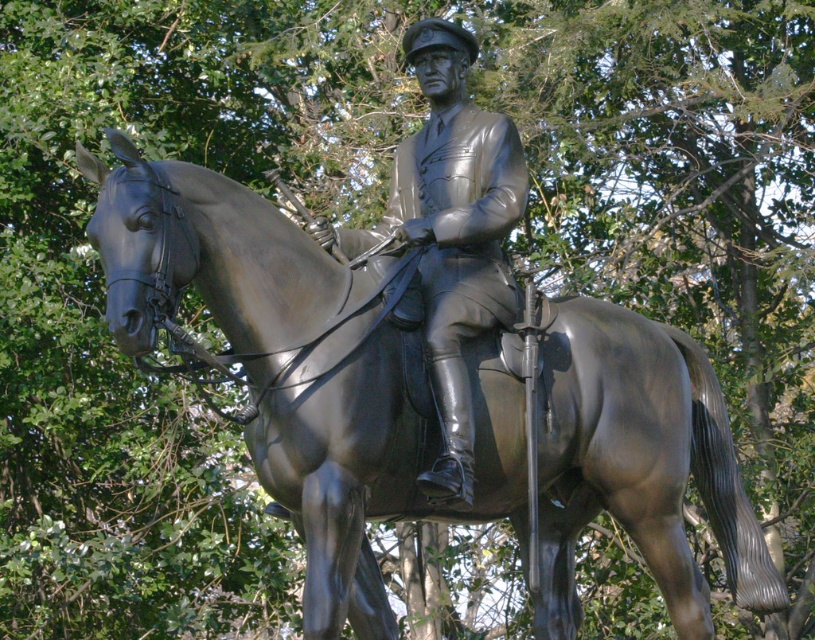
How distant is shiny bronze horse at center from polished bronze statue at center?

shiny bronze horse at center is 34.01 inches away from polished bronze statue at center.

Can you confirm if shiny bronze horse at center is positioned to the left of polished bronze statue at center?

Indeed, shiny bronze horse at center is positioned on the left side of polished bronze statue at center.

Image resolution: width=815 pixels, height=640 pixels. In order to click on shiny bronze horse at center in this screenshot , I will do `click(302, 369)`.